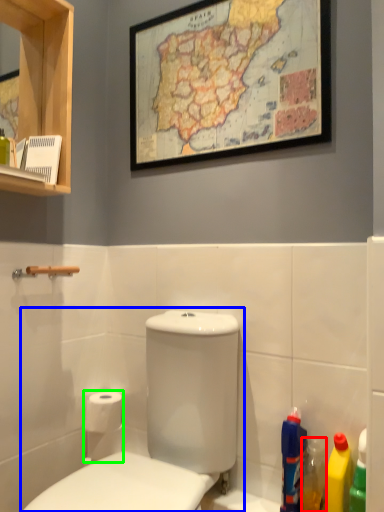
Question: Which object is positioned closest to cleaning product (highlighted by a red box)? Select from toilet (highlighted by a blue box) and toilet paper (highlighted by a green box).

Choices:
 (A) toilet
 (B) toilet paper

Answer: (A)